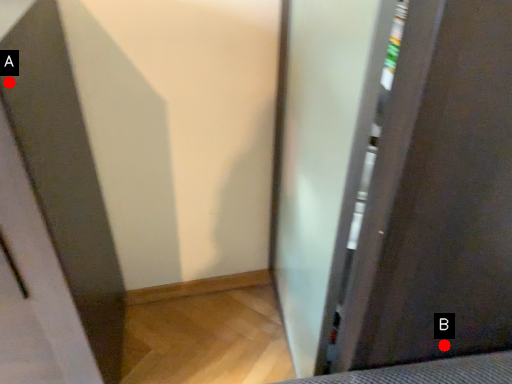
Question: Two points are circled on the image, labeled by A and B beside each circle. Among these points, which one is farthest from the camera?

Choices:
 (A) A is further
 (B) B is further

Answer: (B)